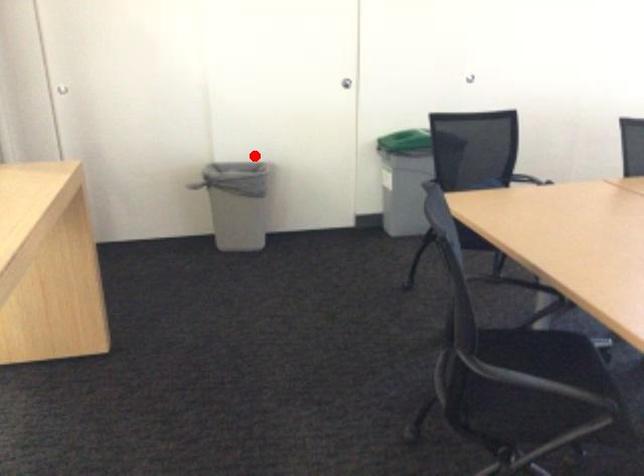
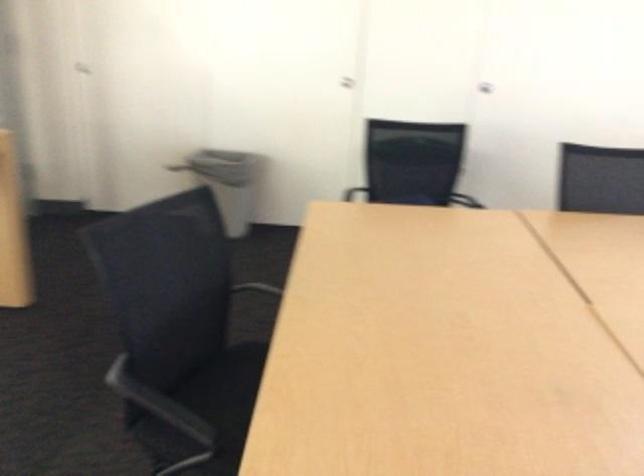
The point at the highlighted location is marked in the first image. Where is the corresponding point in the second image?

(231, 182)